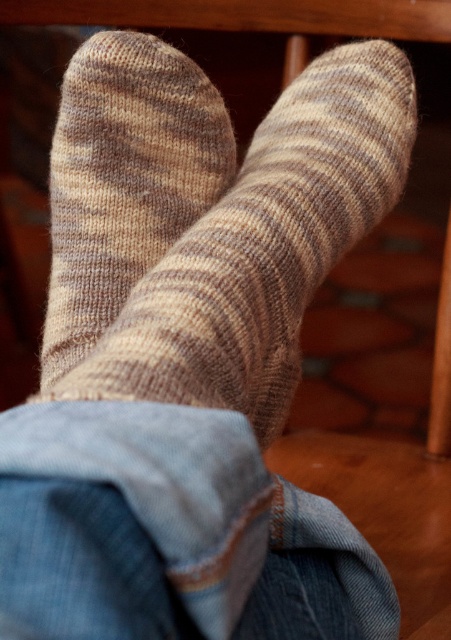
You are standing in front of the wooden chair and want to touch the point at coordinates point (272, 339). If your hand can reach up to 18 inches, will you be able to reach it?

The point at (272, 339) is 18.48 inches from the viewer. Since your hand can only reach up to 18 inches, you will not be able to reach it.